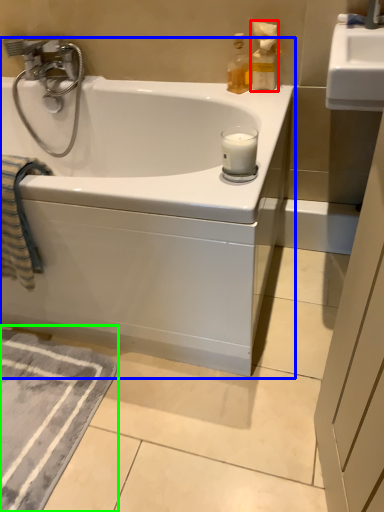
Question: Estimate the real-world distances between objects in this image. Which object is farther from bottle (highlighted by a red box), bathtub (highlighted by a blue box) or bath mat (highlighted by a green box)?

Choices:
 (A) bathtub
 (B) bath mat

Answer: (B)